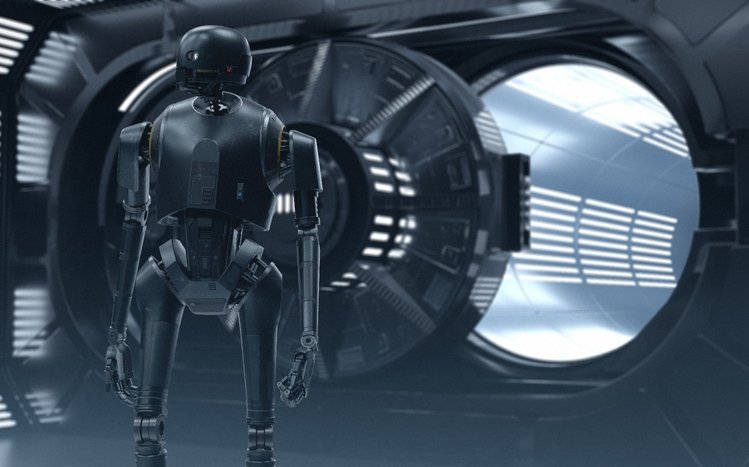
Locate an element on the screen. Image resolution: width=749 pixels, height=467 pixels. light is located at coordinates (589, 288).